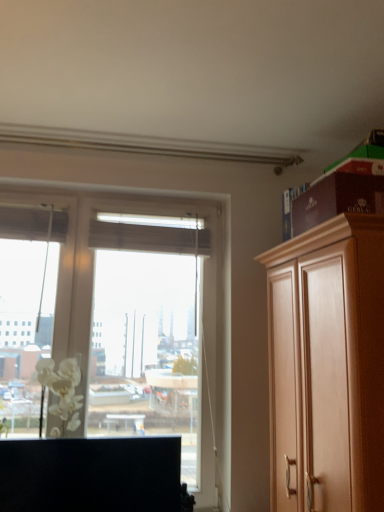
Question: Considering the positions of wooden cabinet at right, which is the second cabinetry in left-to-right order, and black matte cabinet at lower left, marked as the first cabinetry in a left-to-right arrangement, in the image, is wooden cabinet at right, which is the second cabinetry in left-to-right order, wider or thinner than black matte cabinet at lower left, marked as the first cabinetry in a left-to-right arrangement,?

Choices:
 (A) wide
 (B) thin

Answer: (A)

Question: Considering the positions of point (301, 419) and point (72, 501), is point (301, 419) closer or farther from the camera than point (72, 501)?

Choices:
 (A) farther
 (B) closer

Answer: (B)

Question: Which of these objects is positioned closest to the black matte cabinet at lower left, which is counted as the second cabinetry, starting from the right?

Choices:
 (A) wooden cabinet at right, the 1th cabinetry positioned from the right
 (B) white matte flower at left

Answer: (B)

Question: Estimate the real-world distances between objects in this image. Which object is farther from the wooden cabinet at right, which is the second cabinetry in left-to-right order?

Choices:
 (A) black matte cabinet at lower left, which is counted as the second cabinetry, starting from the right
 (B) white matte flower at left

Answer: (B)